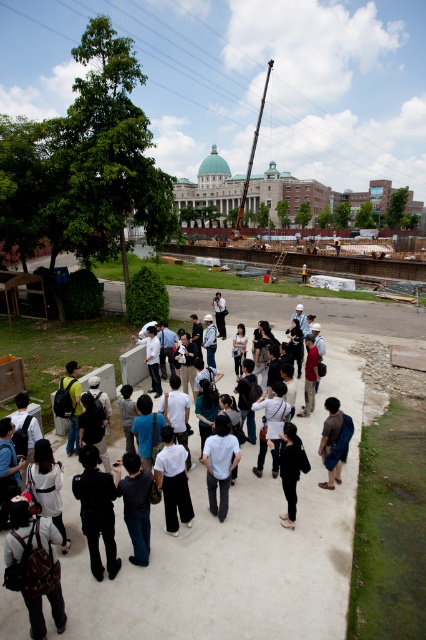
Does white casual clothing at center have a lesser width compared to white matte shirt at center?

No, white casual clothing at center is not thinner than white matte shirt at center.

What do you see at coordinates (229, 550) in the screenshot? I see `white casual clothing at center` at bounding box center [229, 550].

Identify the location of white casual clothing at center. Image resolution: width=426 pixels, height=640 pixels. (229, 550).

In order to click on white casual clothing at center in this screenshot , I will do `click(229, 550)`.

Between white casual clothing at center and brown fabric shirt at center, which one appears on the left side from the viewer's perspective?

Result: From the viewer's perspective, white casual clothing at center appears more on the left side.

At what (x,y) coordinates should I click in order to perform the action: click on white casual clothing at center. Please return your answer as a coordinate pair (x, y). Looking at the image, I should click on (229, 550).

Is point (181, 616) more distant than point (328, 401)?

No, (181, 616) is closer to viewer.

Locate an element on the screen. Image resolution: width=426 pixels, height=640 pixels. white casual clothing at center is located at coordinates (229, 550).

From the picture: Is white matte shirt at center below brown fabric shirt at center?

Indeed, white matte shirt at center is positioned under brown fabric shirt at center.

Is white matte shirt at center smaller than brown fabric shirt at center?

No.

Locate an element on the screen. The image size is (426, 640). white matte shirt at center is located at coordinates (219, 464).

Find the location of a particular element. white matte shirt at center is located at coordinates (219, 464).